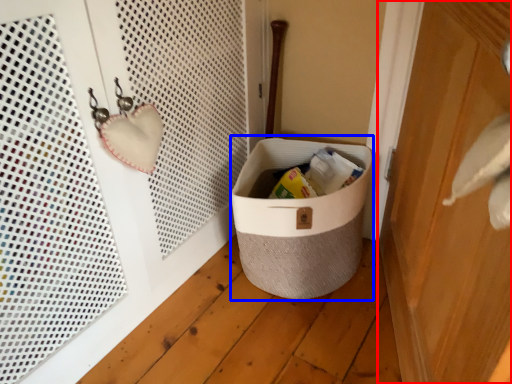
Question: Which point is further to the camera, door (highlighted by a red box) or storage box (highlighted by a blue box)?

Choices:
 (A) door
 (B) storage box

Answer: (B)